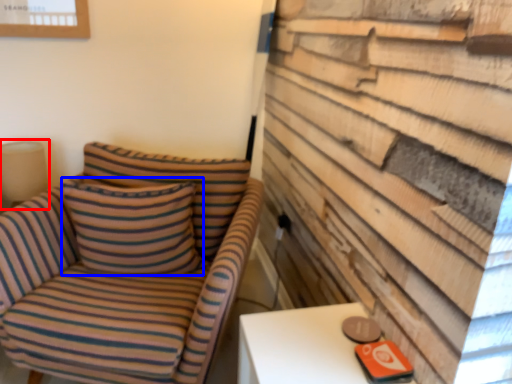
Question: Which object appears farthest to the camera in this image, table lamp (highlighted by a red box) or pillow (highlighted by a blue box)?

Choices:
 (A) table lamp
 (B) pillow

Answer: (A)